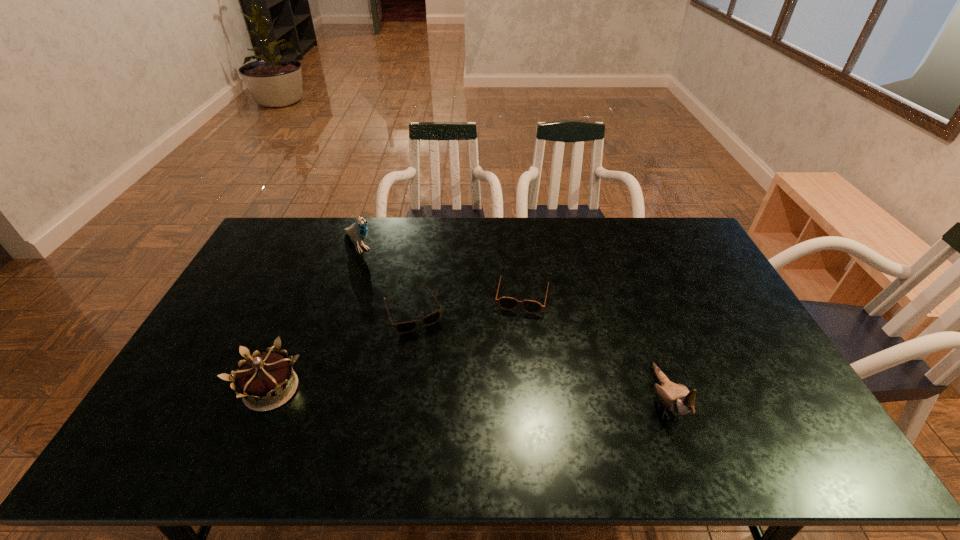
Where is `crown at the near edge`? The height and width of the screenshot is (540, 960). crown at the near edge is located at coordinates (261, 380).

The width and height of the screenshot is (960, 540). In order to click on bird located at the near edge in this screenshot , I will do `click(676, 397)`.

Locate an element on the screen. free region at the far edge of the desktop is located at coordinates (558, 238).

In the image, there is a desktop. Identify the location of free space at the near edge. The image size is (960, 540). (512, 413).

The width and height of the screenshot is (960, 540). In the image, there is a desktop. In order to click on vacant region at the left edge in this screenshot , I will do `click(200, 375)`.

Locate an element on the screen. Image resolution: width=960 pixels, height=540 pixels. free space at the right edge of the desktop is located at coordinates (711, 283).

In order to click on vacant space that is in between the second shortest object and the crown in this screenshot , I will do `click(396, 342)`.

At what (x,y) coordinates should I click in order to perform the action: click on free space between the right bird and the fourth object from left to right. Please return your answer as a coordinate pair (x, y). The height and width of the screenshot is (540, 960). Looking at the image, I should click on (593, 348).

Find the location of a particular element. The height and width of the screenshot is (540, 960). free area in between the third tallest object and the farthest object is located at coordinates (315, 318).

In order to click on empty location between the nearer bird and the fourth tallest object in this screenshot , I will do `click(593, 348)`.